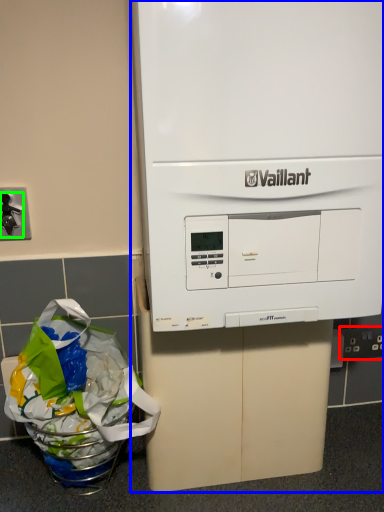
Question: Based on their relative distances, which object is farther from electric outlet (highlighted by a red box)? Choose from home appliance (highlighted by a blue box) and faucet (highlighted by a green box).

Choices:
 (A) home appliance
 (B) faucet

Answer: (B)